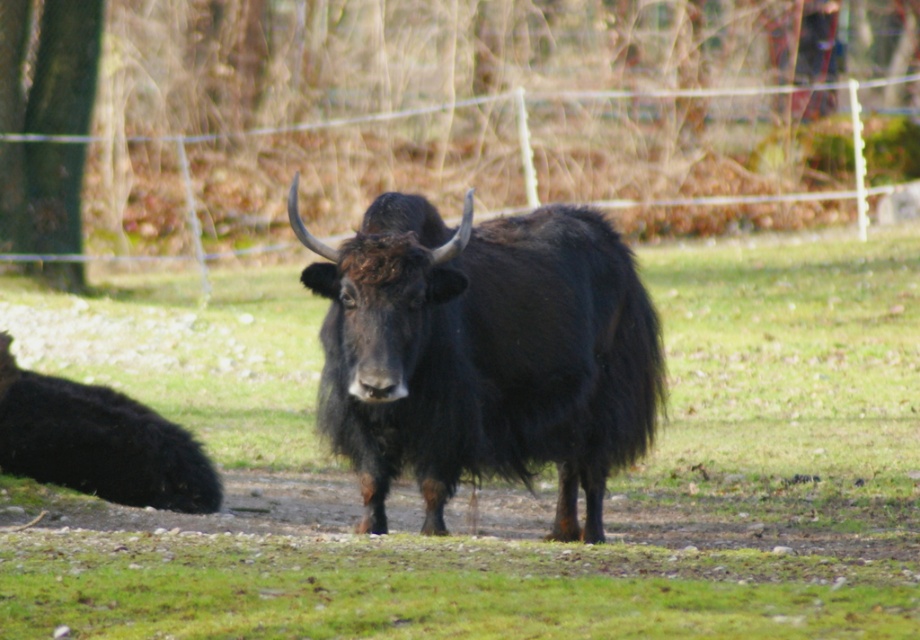
You are a visitor at a wildlife park and see a black fuzzy bull at center and a black fuzzy yak at lower left. Which animal is closer to you?

The black fuzzy bull at center is closer to you because it is positioned over the black fuzzy yak at lower left, indicating it is in front of it.

Looking at this image, you are a zookeeper planning to feed the black fuzzy yak at center. The feeding station is located at coordinate point 0.758, 0.549. Is the yak currently at the feeding station?

The position of black fuzzy yak at center is at point (504,484), so yes, the yak is currently at the feeding station.

Based on the photo, you are a visitor at the zoo and want to take a photo of the black fuzzy bull at center and the black fuzzy yak at lower left. Which animal is positioned closer to the front of the enclosure?

The black fuzzy bull at center is closer to the viewer than the black fuzzy yak at lower left, so the bull is positioned closer to the front of the enclosure.